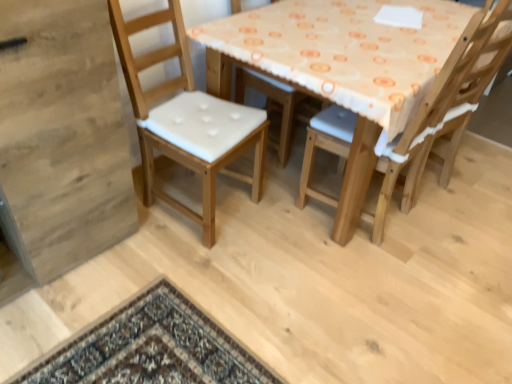
Question: Based on their sizes in the image, would you say light brown wood chair at left, the first chair when ordered from left to right, is bigger or smaller than wooden chair with white cushion at center, acting as the 2th chair starting from the left?

Choices:
 (A) small
 (B) big

Answer: (B)

Question: Does point (112, 11) appear closer or farther from the camera than point (336, 122)?

Choices:
 (A) closer
 (B) farther

Answer: (A)

Question: Considering the positions of light brown wood chair at left, acting as the second chair starting from the right, and wooden chair with white cushion at center, which is counted as the first chair, starting from the right, in the image, is light brown wood chair at left, acting as the second chair starting from the right, taller or shorter than wooden chair with white cushion at center, which is counted as the first chair, starting from the right,?

Choices:
 (A) short
 (B) tall

Answer: (A)

Question: Is wooden chair with white cushion at center, acting as the 2th chair starting from the left, taller or shorter than light brown wood chair at left, the first chair when ordered from left to right?

Choices:
 (A) tall
 (B) short

Answer: (A)

Question: In the image, is wooden chair with white cushion at center, acting as the 2th chair starting from the left, positioned in front of or behind light brown wood chair at left, acting as the second chair starting from the right?

Choices:
 (A) front
 (B) behind

Answer: (B)

Question: Looking at their shapes, would you say wooden chair with white cushion at center, acting as the 2th chair starting from the left, is wider or thinner than light brown wood chair at left, the first chair when ordered from left to right?

Choices:
 (A) wide
 (B) thin

Answer: (A)

Question: Considering the positions of wooden chair with white cushion at center, acting as the 2th chair starting from the left, and light brown wood chair at left, acting as the second chair starting from the right, in the image, is wooden chair with white cushion at center, acting as the 2th chair starting from the left, bigger or smaller than light brown wood chair at left, acting as the second chair starting from the right,?

Choices:
 (A) small
 (B) big

Answer: (A)